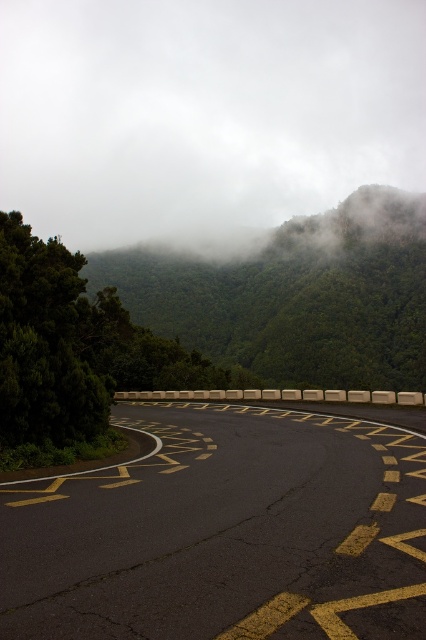
From the picture: You are driving a car and see the white foggy cloud at upper center and the yellow asphalt road at center. Which object is positioned to the right of the other?

The white foggy cloud at upper center is to the right of the yellow asphalt road at center according to the description.

You are a hiker standing at the point marked by the coordinates (x=224, y=534). Based on the scene, what is the most likely feature you are standing on?

The point marked by the coordinates (x=224, y=534) corresponds to the yellow asphalt road at center, so you are most likely standing on the yellow asphalt road at center.

You are a truck driver planning to transport a wide load down the road. The load is 10 meters wide. Given the yellow asphalt road at center and the green leafy forest at upper center, can you safely navigate the road with your load?

The yellow asphalt road at center is narrower than the green leafy forest at upper center. Since the road is narrower than the 10 meters wide load, it is not safe to navigate the road with the load.